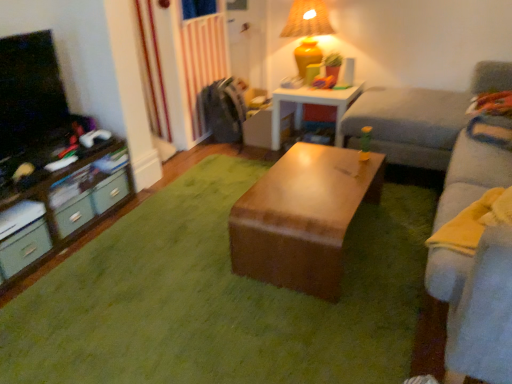
Identify the location of vacant space in front of green matte drawer at left, positioned as the second drawer in back-to-front order. The width and height of the screenshot is (512, 384). (79, 251).